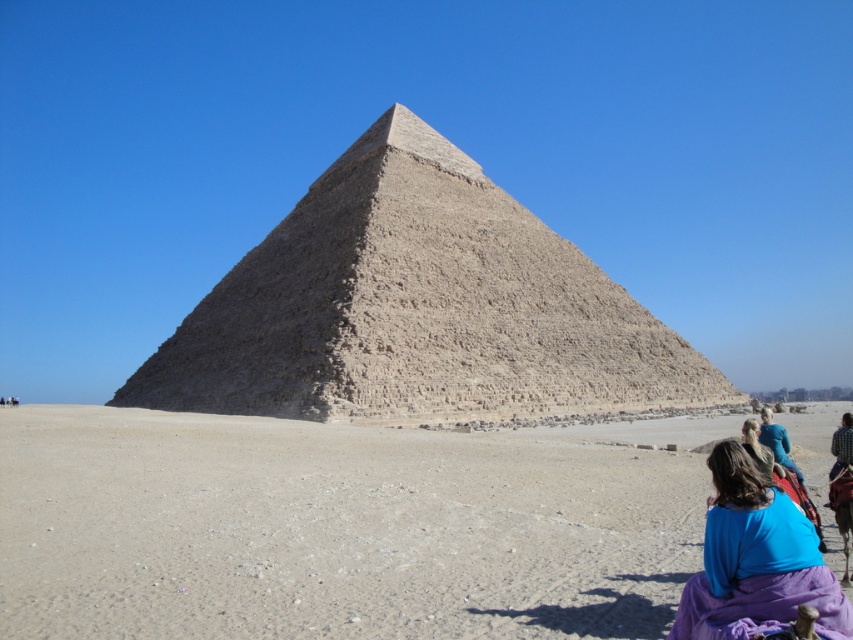
Question: Which point is farther from the camera taking this photo?

Choices:
 (A) (795, 596)
 (B) (639, 540)

Answer: (B)

Question: Estimate the real-world distances between objects in this image. Which object is closer to the brown sandy desert at center?

Choices:
 (A) purple fabric at lower right
 (B) brown stone pyramid at center

Answer: (B)

Question: In this image, where is brown stone pyramid at center located relative to purple fabric at lower right?

Choices:
 (A) right
 (B) left

Answer: (B)

Question: Is brown sandy desert at center further to the viewer compared to brown stone pyramid at center?

Choices:
 (A) no
 (B) yes

Answer: (A)

Question: Is the position of brown stone pyramid at center less distant than that of purple fabric at lower right?

Choices:
 (A) yes
 (B) no

Answer: (B)

Question: Which of the following is the farthest from the observer?

Choices:
 (A) brown stone pyramid at center
 (B) brown sandy desert at center

Answer: (A)